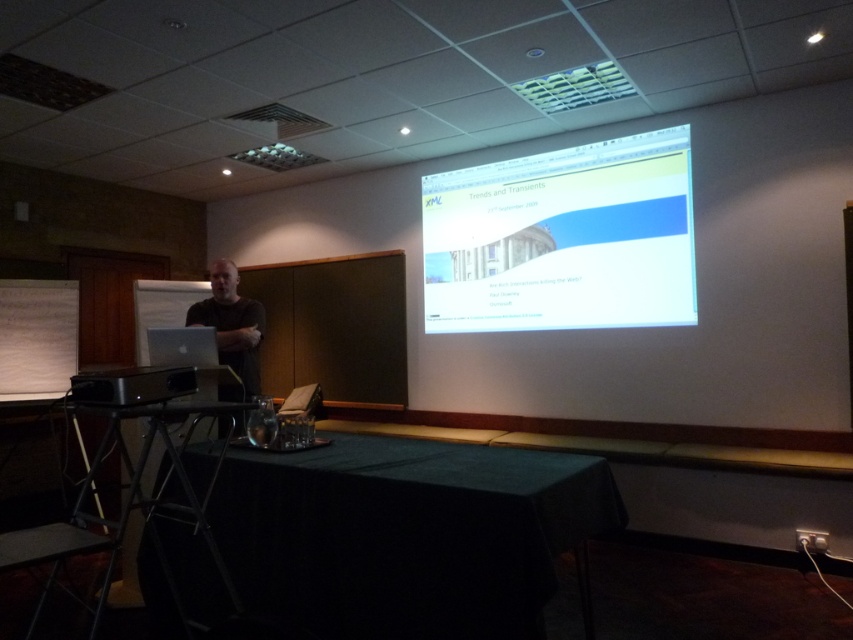
Does point (548, 180) lie in front of point (126, 365)?

Yes, point (548, 180) is closer to viewer.

Does white glossy projector screen at upper center lie in front of black plastic projector at lower left?

No.

Is point (618, 301) farther from camera compared to point (123, 404)?

That is True.

Where is `white glossy projector screen at upper center`? This screenshot has width=853, height=640. white glossy projector screen at upper center is located at coordinates (563, 237).

From the picture: Does black fabric table at lower center appear over white glossy projector screen at upper center?

No.

Can you confirm if black fabric table at lower center is positioned to the right of white glossy projector screen at upper center?

Incorrect, black fabric table at lower center is not on the right side of white glossy projector screen at upper center.

Is point (445, 560) more distant than point (456, 192)?

No, (445, 560) is closer to viewer.

Locate an element on the screen. The image size is (853, 640). black fabric table at lower center is located at coordinates (405, 534).

Can you confirm if black metal table at center is positioned to the left of black plastic projector at lower left?

Correct, you'll find black metal table at center to the left of black plastic projector at lower left.

Between black metal table at center and black plastic projector at lower left, which one appears on the right side from the viewer's perspective?

Positioned to the right is black plastic projector at lower left.

Who is more forward, (209, 483) or (152, 365)?

Point (152, 365) is more forward.

Identify the location of black metal table at center. (163, 481).